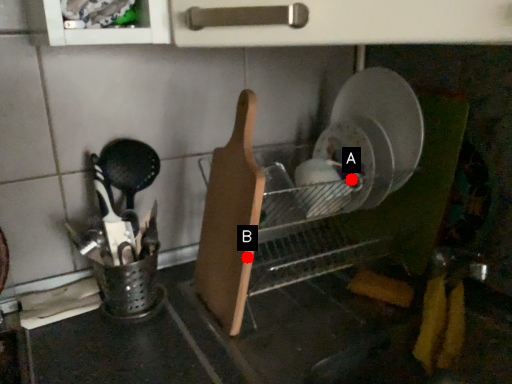
Question: Two points are circled on the image, labeled by A and B beside each circle. Which of the following is the closest to the observer?

Choices:
 (A) A is closer
 (B) B is closer

Answer: (B)